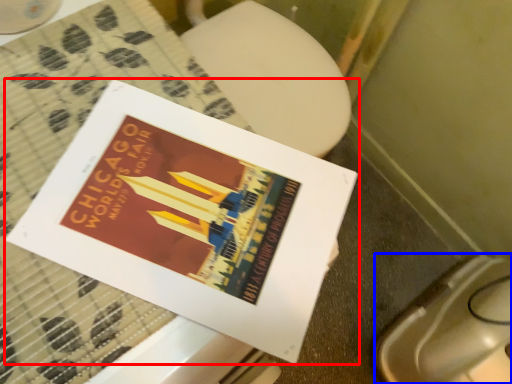
Question: Which point is further to the camera, book (highlighted by a red box) or toilet bowl (highlighted by a blue box)?

Choices:
 (A) book
 (B) toilet bowl

Answer: (B)